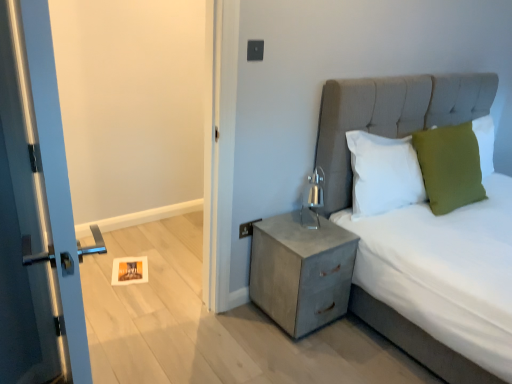
Question: From the image's perspective, would you say metallic gray nightstand at lower right is shown under white soft pillow at upper right, which appears as the 3th pillow when viewed from the right?

Choices:
 (A) yes
 (B) no

Answer: (A)

Question: Is metallic gray nightstand at lower right positioned far away from white soft pillow at upper right, which appears as the 3th pillow when viewed from the right?

Choices:
 (A) yes
 (B) no

Answer: (B)

Question: From the image's perspective, is metallic gray nightstand at lower right located above white soft pillow at upper right, arranged as the 1th pillow when viewed from the left?

Choices:
 (A) yes
 (B) no

Answer: (B)

Question: Is metallic gray nightstand at lower right positioned with its back to white soft pillow at upper right, which appears as the 3th pillow when viewed from the right?

Choices:
 (A) yes
 (B) no

Answer: (B)

Question: From a real-world perspective, is metallic gray nightstand at lower right positioned over white soft pillow at upper right, which appears as the 3th pillow when viewed from the right, based on gravity?

Choices:
 (A) yes
 (B) no

Answer: (B)

Question: Is metallic gray nightstand at lower right smaller than white soft pillow at upper right, arranged as the 1th pillow when viewed from the left?

Choices:
 (A) yes
 (B) no

Answer: (B)

Question: From a real-world perspective, does textured gray bed at center stand above metallic gray electric outlet at upper right?

Choices:
 (A) yes
 (B) no

Answer: (A)

Question: Does textured gray bed at center have a larger size compared to metallic gray electric outlet at upper right?

Choices:
 (A) yes
 (B) no

Answer: (A)

Question: Does textured gray bed at center have a greater height compared to metallic gray electric outlet at upper right?

Choices:
 (A) yes
 (B) no

Answer: (A)

Question: Is textured gray bed at center positioned behind metallic gray electric outlet at upper right?

Choices:
 (A) yes
 (B) no

Answer: (B)

Question: Is textured gray bed at center wider than metallic gray electric outlet at upper right?

Choices:
 (A) no
 (B) yes

Answer: (B)

Question: From a real-world perspective, is textured gray bed at center beneath metallic gray electric outlet at upper right?

Choices:
 (A) yes
 (B) no

Answer: (B)

Question: Is metallic gray electric outlet at upper right closer to camera compared to green fabric pillow at upper right, positioned as the third pillow in left-to-right order?

Choices:
 (A) yes
 (B) no

Answer: (A)